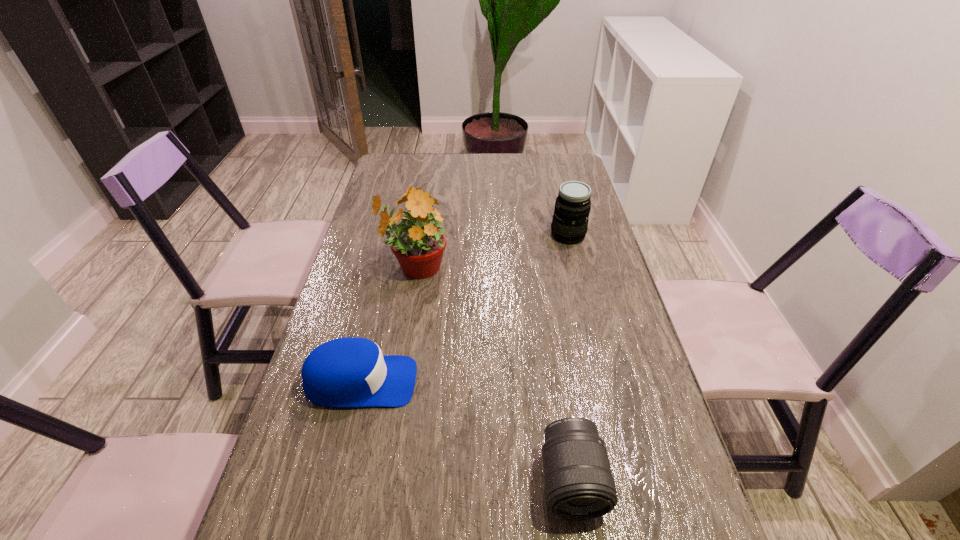
Locate an element on the screen. flowerpot present at the left edge is located at coordinates (418, 242).

Identify the location of baseball cap positioned at the left edge. The image size is (960, 540). (346, 372).

Identify the location of blank area at the far edge. This screenshot has height=540, width=960. (426, 165).

Find the location of a particular element. The image size is (960, 540). blank space at the left edge of the desktop is located at coordinates (319, 484).

You are a GUI agent. You are given a task and a screenshot of the screen. Output one action in this format:
    pyautogui.click(x=<x>, y=<y>)
    Task: Click on the free space at the right edge of the desktop
    The image size is (960, 540).
    Given the screenshot: What is the action you would take?
    pyautogui.click(x=604, y=371)

This screenshot has height=540, width=960. In order to click on free point at the far left corner in this screenshot , I will do `click(395, 178)`.

Find the location of a particular element. The width and height of the screenshot is (960, 540). vacant space in between the flowerpot and the farther telephoto lens is located at coordinates (492, 252).

This screenshot has height=540, width=960. In order to click on blank region between the tallest object and the farther telephoto lens in this screenshot , I will do `click(492, 252)`.

The image size is (960, 540). Identify the location of free spot between the nearest object and the flowerpot. (493, 375).

Locate an element on the screen. vacant area that lies between the third shortest object and the flowerpot is located at coordinates (492, 252).